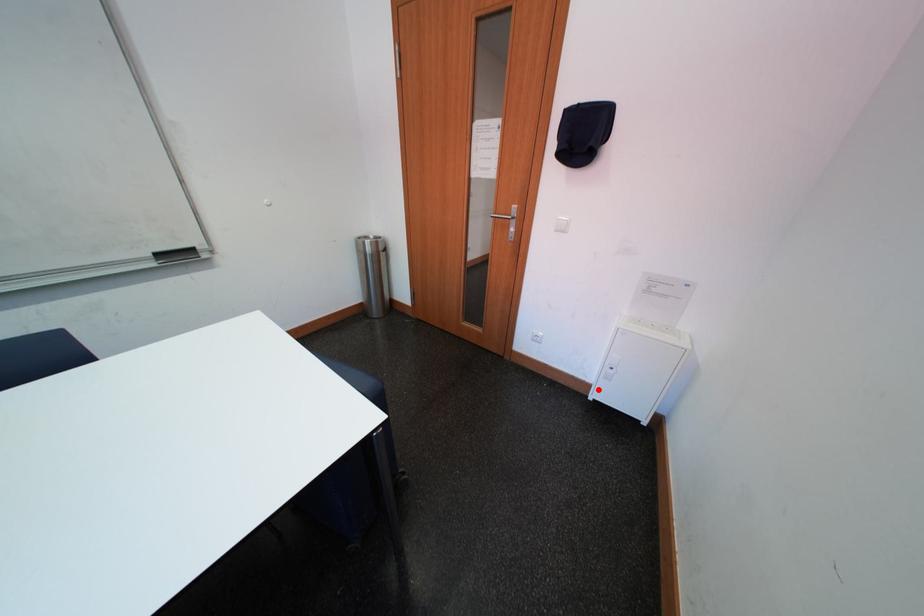
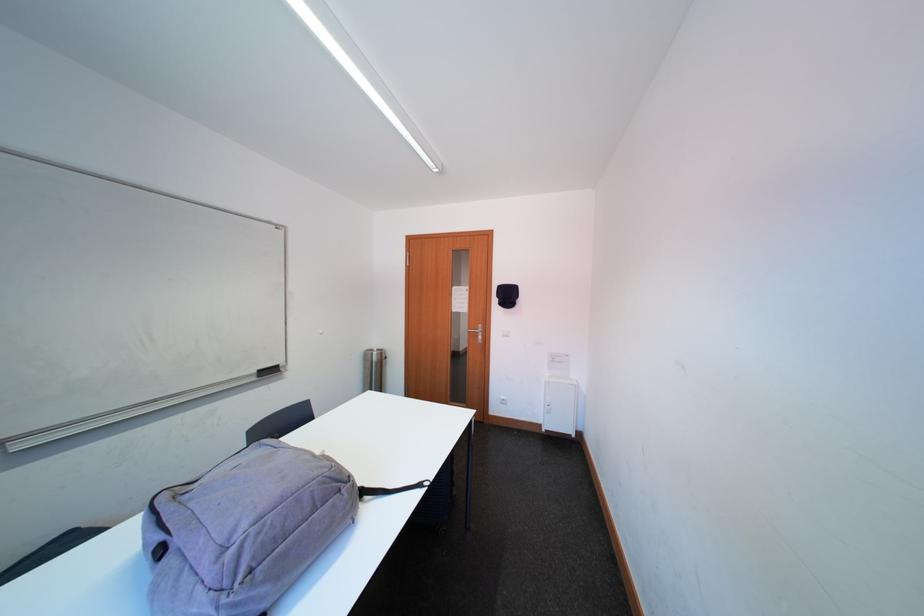
Question: A red point is marked in image1. In image2, is the corresponding 3D point closer to the camera or farther? Reply with the corresponding letter.

Choices:
 (A) The corresponding 3D point is closer.
 (B) The corresponding 3D point is farther.

Answer: (B)